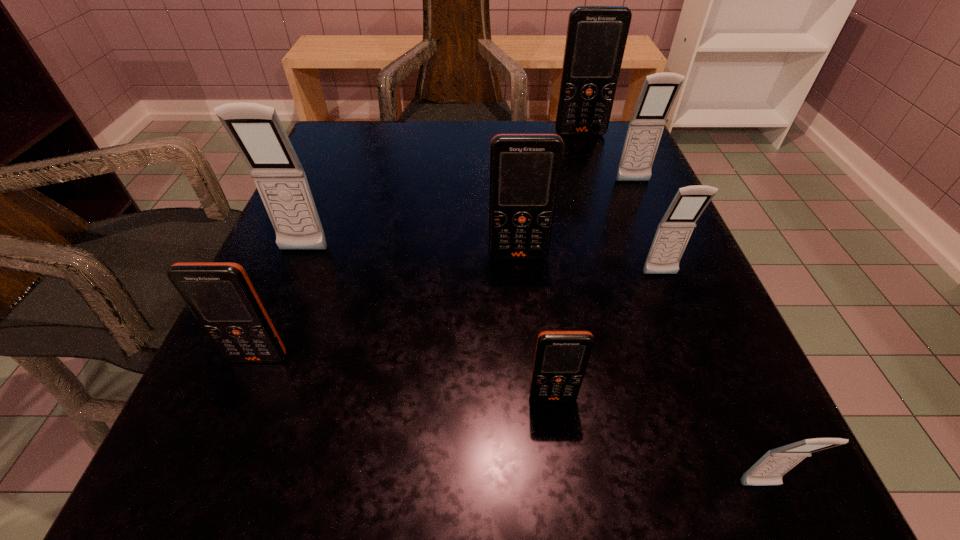
This screenshot has height=540, width=960. What are the coordinates of `free space located on the screen of the sixth farthest cellular telephone` in the screenshot? It's located at (230, 428).

You are a GUI agent. You are given a task and a screenshot of the screen. Output one action in this format:
    pyautogui.click(x=<x>, y=<y>)
    Task: Click on the vacant space situated 0.050m on the screen of the second nearest cellular telephone
    The height and width of the screenshot is (540, 960).
    Given the screenshot: What is the action you would take?
    pyautogui.click(x=559, y=441)

Where is `object positioned at the far edge`? object positioned at the far edge is located at coordinates [x=596, y=38].

Where is `object situated at the near edge`? Image resolution: width=960 pixels, height=540 pixels. object situated at the near edge is located at coordinates [769, 469].

In order to click on object located at the far right corner in this screenshot , I will do `click(596, 38)`.

This screenshot has height=540, width=960. Identify the location of object present at the near right corner. (769, 469).

Identify the location of blank space at the far edge. (488, 157).

This screenshot has width=960, height=540. In the image, there is a desktop. Find the location of `free space at the near edge`. free space at the near edge is located at coordinates (620, 448).

Find the location of a particular element. The height and width of the screenshot is (540, 960). blank space at the left edge of the desktop is located at coordinates (326, 276).

Where is `vacant region at the right edge of the desktop`? vacant region at the right edge of the desktop is located at coordinates (727, 362).